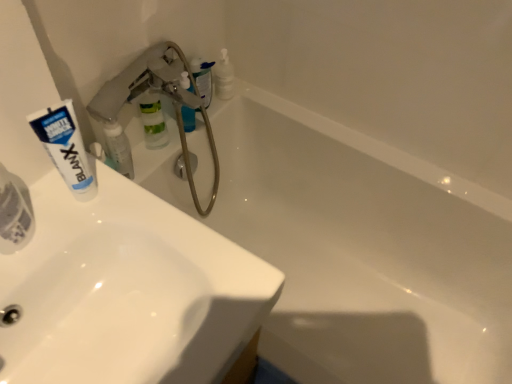
At what (x,y) coordinates should I click in order to perform the action: click on empty space that is to the right of white matte tube at upper left. Please return your answer as a coordinate pair (x, y). The width and height of the screenshot is (512, 384). Looking at the image, I should click on (172, 241).